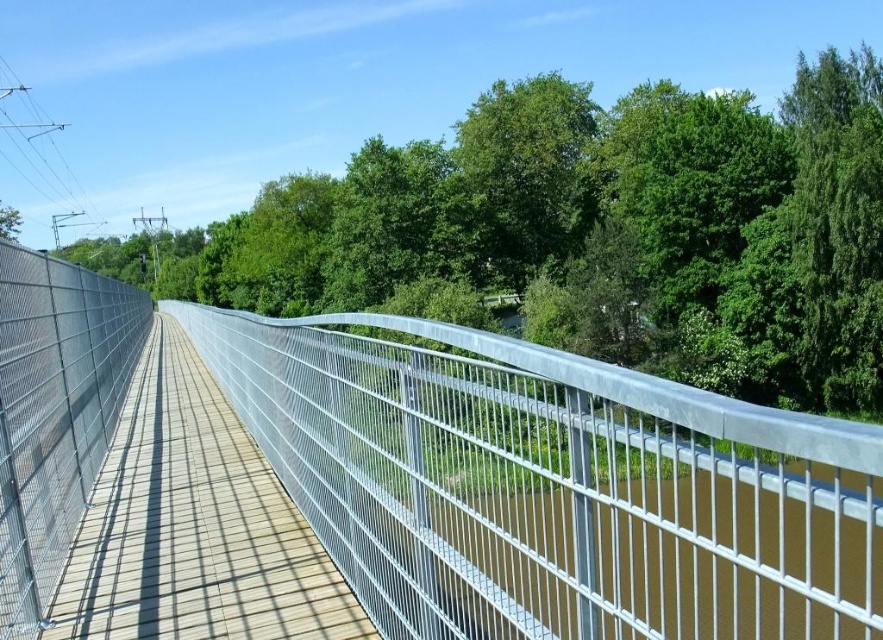
Is point (670, 580) more distant than point (189, 401)?

No, (670, 580) is in front of (189, 401).

Can you confirm if silver metallic fence at center is shorter than wooden planks at center?

No, silver metallic fence at center is not shorter than wooden planks at center.

Between point (509, 472) and point (49, 637), which one is positioned behind?

The point (509, 472) is more distant.

Locate an element on the screen. silver metallic fence at center is located at coordinates (551, 484).

Who is more distant from viewer, (470, 595) or (651, 118)?

Positioned behind is point (651, 118).

Between silver metallic fence at center and green leafy tree at upper center, which one appears on the left side from the viewer's perspective?

From the viewer's perspective, green leafy tree at upper center appears more on the left side.

Identify the location of silver metallic fence at center. (551, 484).

Identify the location of silver metallic fence at center. The width and height of the screenshot is (883, 640). (551, 484).

Is green leafy tree at upper center smaller than wooden planks at center?

Incorrect, green leafy tree at upper center is not smaller in size than wooden planks at center.

Locate an element on the screen. green leafy tree at upper center is located at coordinates (591, 232).